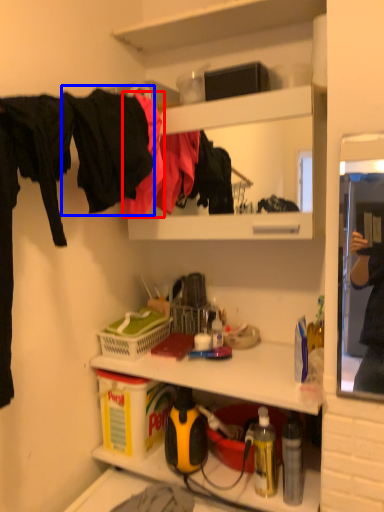
Question: Among these objects, which one is farthest to the camera, clothing (highlighted by a red box) or clothing (highlighted by a blue box)?

Choices:
 (A) clothing
 (B) clothing

Answer: (A)